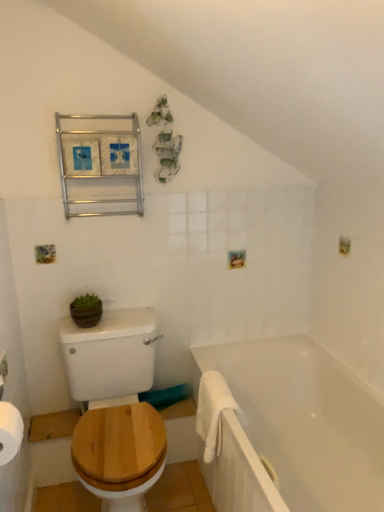
Question: Considering the positions of metallic frame at upper left and wooden at left in the image, is metallic frame at upper left bigger or smaller than wooden at left?

Choices:
 (A) small
 (B) big

Answer: (A)

Question: From the image's perspective, is metallic frame at upper left located above or below wooden at left?

Choices:
 (A) above
 (B) below

Answer: (A)

Question: Estimate the real-world distances between objects in this image. Which object is farther from the wooden at left?

Choices:
 (A) metallic frame at upper left
 (B) white fluffy bath towel at lower right
 (C) white paper at lower left
 (D) green matte pot at center
 (E) white glossy bathtub at lower right

Answer: (A)

Question: Estimate the real-world distances between objects in this image. Which object is closer to the green matte pot at center?

Choices:
 (A) wooden at left
 (B) white fluffy bath towel at lower right
 (C) metallic frame at upper left
 (D) white paper at lower left
 (E) white glossy bathtub at lower right

Answer: (A)